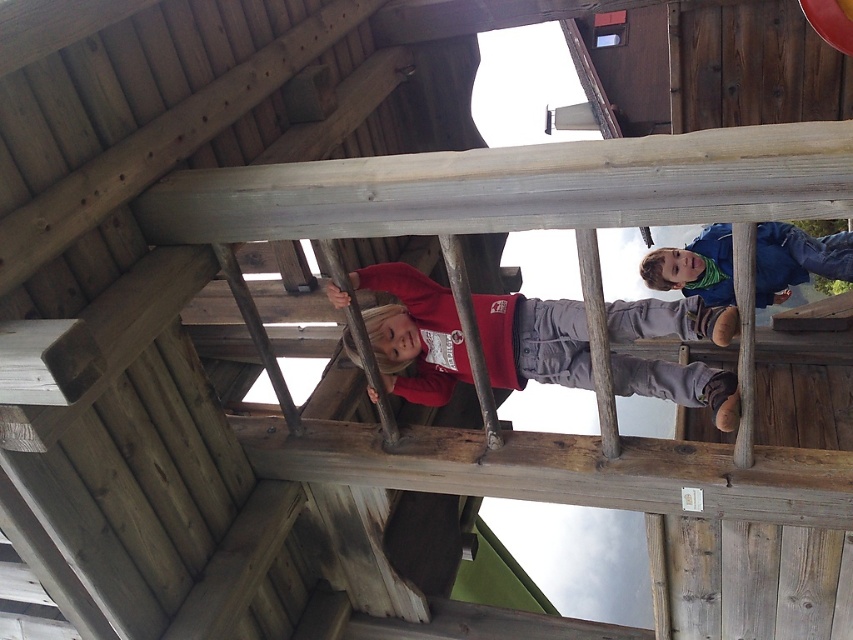
Is matte red hoodie at center bigger than blue fleece jacket at upper center?

Yes, matte red hoodie at center is bigger than blue fleece jacket at upper center.

The width and height of the screenshot is (853, 640). Describe the element at coordinates (418, 332) in the screenshot. I see `matte red hoodie at center` at that location.

Locate an element on the screen. matte red hoodie at center is located at coordinates (418, 332).